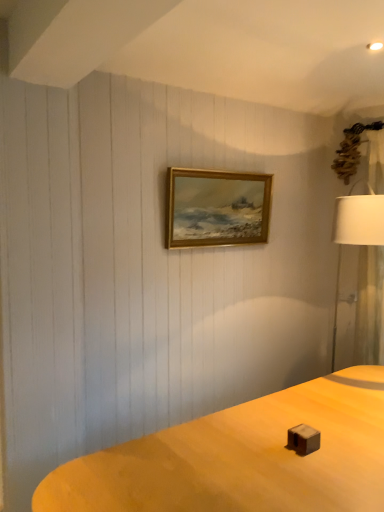
Question: From a real-world perspective, relative to gold wooden picture frame at center, is white fabric lampshade at right vertically above or below?

Choices:
 (A) above
 (B) below

Answer: (B)

Question: Is white fabric lampshade at right in front of or behind gold wooden picture frame at center in the image?

Choices:
 (A) behind
 (B) front

Answer: (B)

Question: Considering the positions of white fabric lampshade at right and gold wooden picture frame at center in the image, is white fabric lampshade at right bigger or smaller than gold wooden picture frame at center?

Choices:
 (A) small
 (B) big

Answer: (B)

Question: Considering the positions of gold wooden picture frame at center and white fabric lampshade at right in the image, is gold wooden picture frame at center wider or thinner than white fabric lampshade at right?

Choices:
 (A) thin
 (B) wide

Answer: (A)

Question: In the image, is gold wooden picture frame at center on the left side or the right side of white fabric lampshade at right?

Choices:
 (A) left
 (B) right

Answer: (A)

Question: From a real-world perspective, is gold wooden picture frame at center above or below white fabric lampshade at right?

Choices:
 (A) below
 (B) above

Answer: (B)

Question: In terms of height, does gold wooden picture frame at center look taller or shorter compared to white fabric lampshade at right?

Choices:
 (A) short
 (B) tall

Answer: (A)